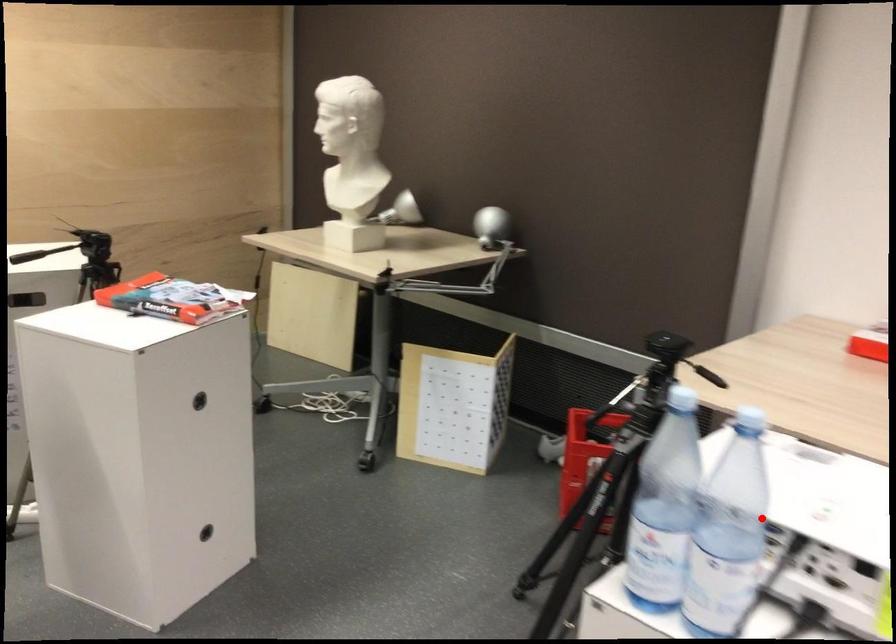
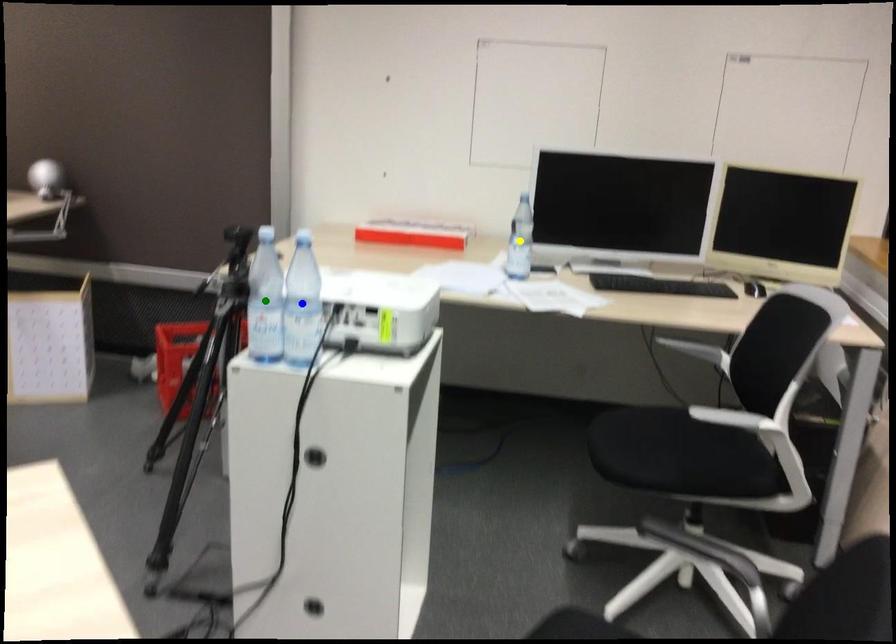
Question: I am providing you with two images of the same scene from different viewpoints. A red point is marked on the first image. You are given multiple points on the second image. Which spot in image 2 lines up with the point in image 1?

Choices:
 (A) yellow point
 (B) green point
 (C) blue point

Answer: (C)